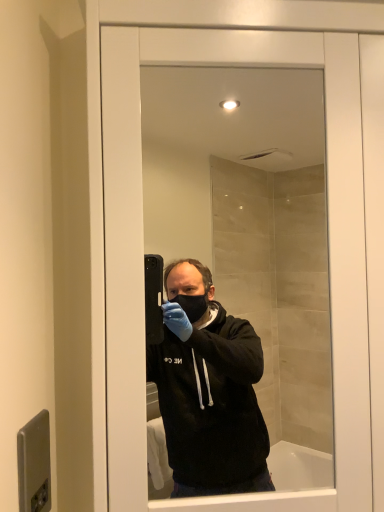
This screenshot has height=512, width=384. I want to click on metallic gray door handle at lower left, so (34, 464).

Describe the element at coordinates (34, 464) in the screenshot. This screenshot has height=512, width=384. I see `metallic gray door handle at lower left` at that location.

In order to face metallic gray door handle at lower left, should I rotate leftwards or rightwards?

It's best to rotate left around 20.780 degrees.

What is the approximate height of metallic gray door handle at lower left?

metallic gray door handle at lower left is 5.84 inches tall.

The height and width of the screenshot is (512, 384). Find the location of `transparent glass mirror at center`. transparent glass mirror at center is located at coordinates pos(252,229).

What do you see at coordinates (252, 229) in the screenshot?
I see `transparent glass mirror at center` at bounding box center [252, 229].

What is the approximate width of transparent glass mirror at center?

transparent glass mirror at center is 6.20 inches in width.

At what (x,y) coordinates should I click in order to perform the action: click on metallic gray door handle at lower left. Please return your answer as a coordinate pair (x, y). Looking at the image, I should click on [34, 464].

Which is more to the left, metallic gray door handle at lower left or transparent glass mirror at center?

From the viewer's perspective, metallic gray door handle at lower left appears more on the left side.

Who is more distant, metallic gray door handle at lower left or transparent glass mirror at center?

transparent glass mirror at center is more distant.

Which is closer, (41, 460) or (310, 360)?

The point (41, 460) is closer to the camera.

From the image's perspective, is metallic gray door handle at lower left located above or below transparent glass mirror at center?

metallic gray door handle at lower left is situated lower than transparent glass mirror at center in the image.

From a real-world perspective, is metallic gray door handle at lower left physically located above or below transparent glass mirror at center?

metallic gray door handle at lower left is situated lower than transparent glass mirror at center in the real world.

Which of these two, metallic gray door handle at lower left or transparent glass mirror at center, is wider?

With larger width is transparent glass mirror at center.

Looking at this image, can you confirm if metallic gray door handle at lower left is shorter than transparent glass mirror at center?

Correct, metallic gray door handle at lower left is not as tall as transparent glass mirror at center.

Does metallic gray door handle at lower left have a smaller size compared to transparent glass mirror at center?

Indeed, metallic gray door handle at lower left has a smaller size compared to transparent glass mirror at center.

Would you say metallic gray door handle at lower left is inside or outside transparent glass mirror at center?

metallic gray door handle at lower left is not inside transparent glass mirror at center, it's outside.

Can you see metallic gray door handle at lower left touching transparent glass mirror at center?

No, metallic gray door handle at lower left is not touching transparent glass mirror at center.

Based on the photo, is metallic gray door handle at lower left positioned with its back to transparent glass mirror at center?

No, metallic gray door handle at lower left's orientation is not away from transparent glass mirror at center.

Measure the distance between metallic gray door handle at lower left and transparent glass mirror at center.

The distance of metallic gray door handle at lower left from transparent glass mirror at center is 6.27 feet.

Find the location of a particular element. mirror above the metallic gray door handle at lower left (from the image's perspective) is located at coordinates (252, 229).

Considering the positions of objects transparent glass mirror at center and metallic gray door handle at lower left in the image provided, who is more to the left, transparent glass mirror at center or metallic gray door handle at lower left?

metallic gray door handle at lower left.

Is the position of transparent glass mirror at center more distant than that of metallic gray door handle at lower left?

Yes, the depth of transparent glass mirror at center is greater than that of metallic gray door handle at lower left.

Does point (309, 146) lie in front of point (39, 418)?

No.

From the image's perspective, is transparent glass mirror at center above metallic gray door handle at lower left?

Indeed, from the image's perspective, transparent glass mirror at center is shown above metallic gray door handle at lower left.

From a real-world perspective, relative to metallic gray door handle at lower left, is transparent glass mirror at center vertically above or below?

From a real-world perspective, transparent glass mirror at center is physically above metallic gray door handle at lower left.

In terms of width, does transparent glass mirror at center look wider or thinner when compared to metallic gray door handle at lower left?

In the image, transparent glass mirror at center appears to be wider than metallic gray door handle at lower left.

Which of these two, transparent glass mirror at center or metallic gray door handle at lower left, stands shorter?

Standing shorter between the two is metallic gray door handle at lower left.

Is transparent glass mirror at center smaller than metallic gray door handle at lower left?

Incorrect, transparent glass mirror at center is not smaller in size than metallic gray door handle at lower left.

Do you think transparent glass mirror at center is within metallic gray door handle at lower left, or outside of it?

transparent glass mirror at center is outside metallic gray door handle at lower left.

Would you say transparent glass mirror at center is a long distance from metallic gray door handle at lower left?

Absolutely, transparent glass mirror at center is distant from metallic gray door handle at lower left.

Is transparent glass mirror at center oriented towards metallic gray door handle at lower left?

No.

How far apart are transparent glass mirror at center and metallic gray door handle at lower left?

transparent glass mirror at center and metallic gray door handle at lower left are 1.91 meters apart from each other.

At what (x,y) coordinates should I click in order to perform the action: click on door handle below the transparent glass mirror at center (from the image's perspective). Please return your answer as a coordinate pair (x, y). Looking at the image, I should click on (34, 464).

In order to click on mirror that is behind the metallic gray door handle at lower left in this screenshot , I will do (x=252, y=229).

Locate an element on the screen. The width and height of the screenshot is (384, 512). mirror on the right side of metallic gray door handle at lower left is located at coordinates (252, 229).